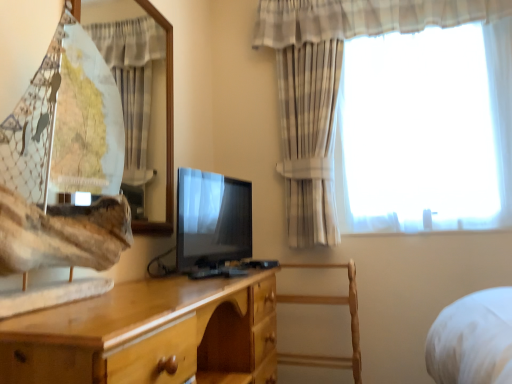
Question: Is wooden chair at center at the left side of plaid fabric curtain at upper right, the 1th curtain from the right?

Choices:
 (A) yes
 (B) no

Answer: (A)

Question: Does wooden chair at center contain plaid fabric curtain at upper right, the second curtain in the left-to-right sequence?

Choices:
 (A) no
 (B) yes

Answer: (A)

Question: Are wooden chair at center and plaid fabric curtain at upper right, the second curtain in the left-to-right sequence, beside each other?

Choices:
 (A) yes
 (B) no

Answer: (B)

Question: From a real-world perspective, is wooden chair at center on plaid fabric curtain at upper right, the second curtain in the left-to-right sequence?

Choices:
 (A) yes
 (B) no

Answer: (B)

Question: From the image's perspective, is wooden chair at center beneath plaid fabric curtain at upper right, the 1th curtain from the right?

Choices:
 (A) no
 (B) yes

Answer: (B)

Question: Relative to wooden chair at center, is plaid fabric curtain at upper left, placed as the 1th curtain when sorted from left to right, in front or behind?

Choices:
 (A) front
 (B) behind

Answer: (A)

Question: From the image's perspective, is plaid fabric curtain at upper left, placed as the 1th curtain when sorted from left to right, above or below wooden chair at center?

Choices:
 (A) below
 (B) above

Answer: (B)

Question: Do you think plaid fabric curtain at upper left, acting as the second curtain starting from the right, is within wooden chair at center, or outside of it?

Choices:
 (A) inside
 (B) outside

Answer: (B)

Question: Does point (136, 34) appear closer or farther from the camera than point (301, 301)?

Choices:
 (A) closer
 (B) farther

Answer: (B)

Question: Is point (313, 91) positioned closer to the camera than point (181, 256)?

Choices:
 (A) closer
 (B) farther

Answer: (B)

Question: Considering their positions, is plaid fabric curtain at upper right, the second curtain in the left-to-right sequence, located in front of or behind matte black tv at center?

Choices:
 (A) behind
 (B) front

Answer: (A)

Question: Is plaid fabric curtain at upper right, the second curtain in the left-to-right sequence, to the left or to the right of matte black tv at center in the image?

Choices:
 (A) left
 (B) right

Answer: (B)

Question: Is plaid fabric curtain at upper right, the second curtain in the left-to-right sequence, wider or thinner than matte black tv at center?

Choices:
 (A) thin
 (B) wide

Answer: (B)

Question: Considering the positions of wooden chair at center and matte black tv at center in the image, is wooden chair at center taller or shorter than matte black tv at center?

Choices:
 (A) tall
 (B) short

Answer: (A)

Question: Considering their positions, is wooden chair at center located in front of or behind matte black tv at center?

Choices:
 (A) front
 (B) behind

Answer: (B)